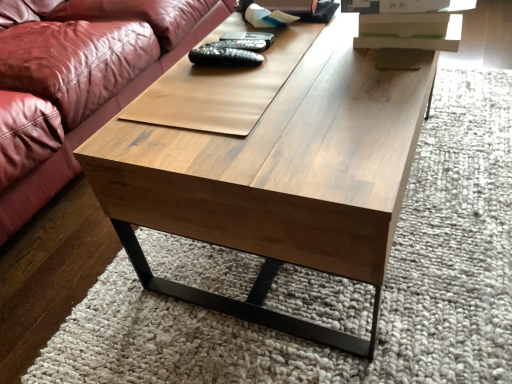
What are the coordinates of `free space above wooden coffee table at center (from a real-world perspective)` in the screenshot? It's located at (287, 79).